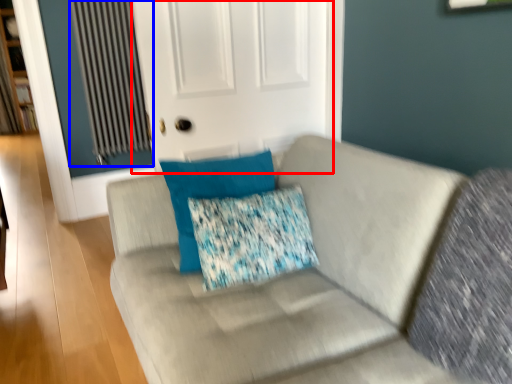
Question: Which of the following is the farthest to the observer, screen door (highlighted by a red box) or radiator (highlighted by a blue box)?

Choices:
 (A) screen door
 (B) radiator

Answer: (B)